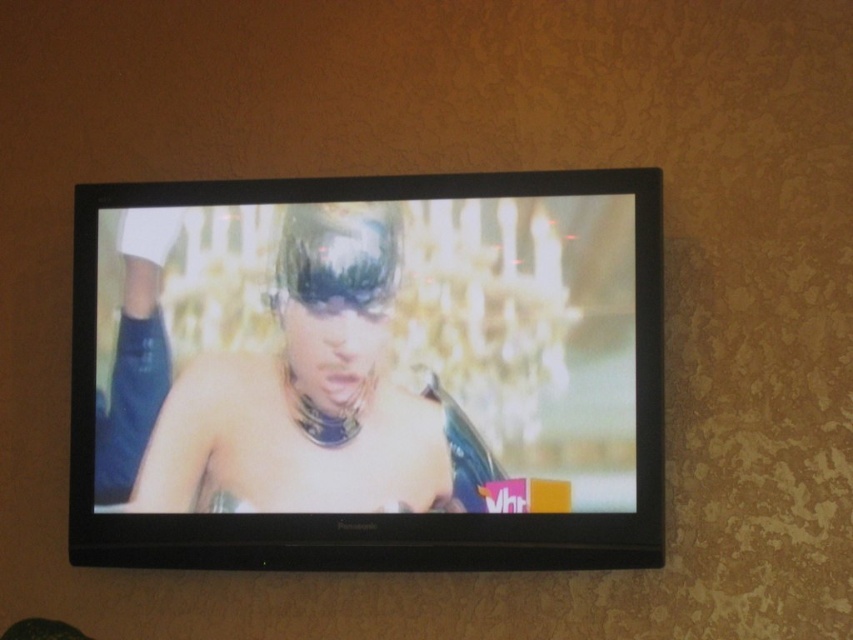
Question: Among these objects, which one is nearest to the camera?

Choices:
 (A) shiny black hair at center
 (B) black glossy tv at center

Answer: (B)

Question: Can you confirm if black glossy tv at center is bigger than shiny black hair at center?

Choices:
 (A) no
 (B) yes

Answer: (B)

Question: Which of the following is the closest to the observer?

Choices:
 (A) shiny black hair at center
 (B) black glossy tv at center

Answer: (B)

Question: Is black glossy tv at center closer to camera compared to shiny black hair at center?

Choices:
 (A) no
 (B) yes

Answer: (B)

Question: Does black glossy tv at center lie behind shiny black hair at center?

Choices:
 (A) yes
 (B) no

Answer: (B)

Question: Among these objects, which one is farthest from the camera?

Choices:
 (A) black glossy tv at center
 (B) shiny black hair at center

Answer: (B)